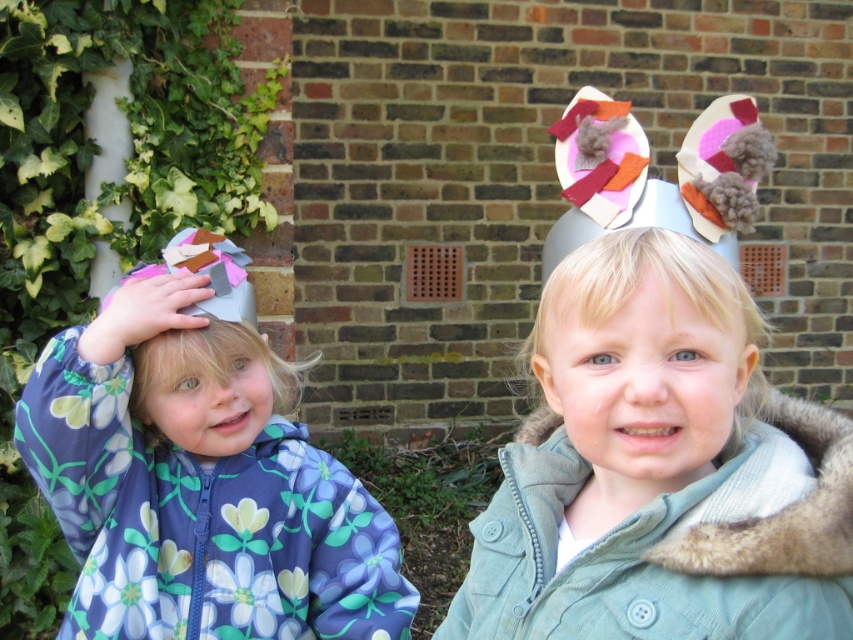
You are a tailor who needs to determine which item requires more fabric to make between the light green corduroy jacket at center and the fuzzy gray hat at center. Based on the image, which item would need more fabric?

The light green corduroy jacket at center is bigger than the fuzzy gray hat at center, so it would require more fabric to make.

You are a photographer setting up for a group photo. You have two items in the scene, the floral fabric jacket at left and the fluffy white hat at left. Which item should you focus on if you want to capture the larger object in the frame?

The floral fabric jacket at left is larger in size than the fluffy white hat at left, so you should focus on the floral fabric jacket at left to capture the larger object in the frame.